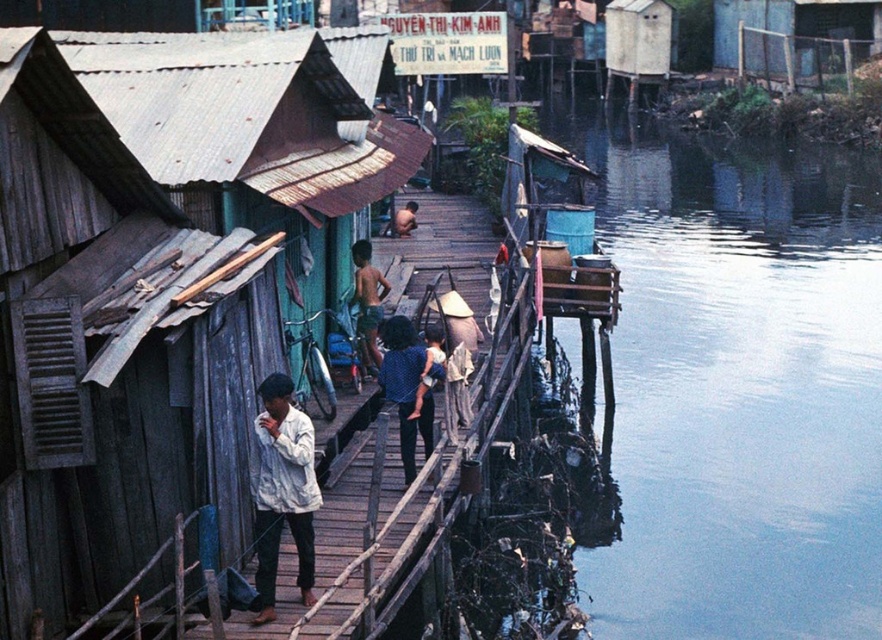
Question: Which point is closer to the camera?

Choices:
 (A) (290, 486)
 (B) (789, 355)
 (C) (387, 340)

Answer: (A)

Question: Where is blue dotted shirt at center located in relation to light brown shorts at center in the image?

Choices:
 (A) right
 (B) left

Answer: (A)

Question: Which point is farther to the camera?

Choices:
 (A) blue water at right
 (B) blue dotted shirt at center
 (C) rusty corrugated metal hut at center

Answer: (A)

Question: In this image, where is blue water at right located relative to blue dotted shirt at center?

Choices:
 (A) left
 (B) right

Answer: (B)

Question: Which of these objects is positioned closest to the blue water at right?

Choices:
 (A) rusty corrugated metal hut at center
 (B) light brown shorts at center

Answer: (A)

Question: Is light brown shorts at center above light brown skin at center?

Choices:
 (A) yes
 (B) no

Answer: (B)